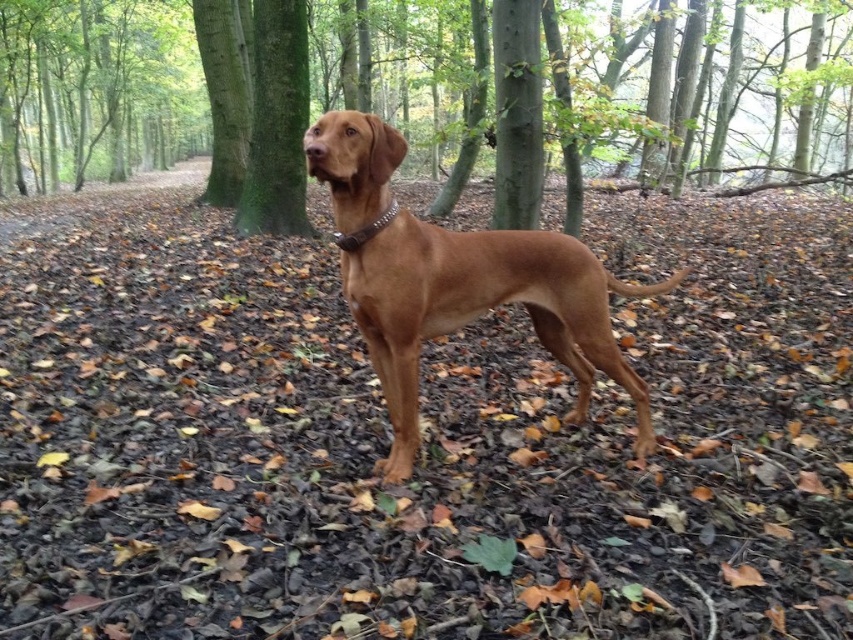
You are a hiker who wants to take a photo of the brown leather dog at center and the brown bark tree at center. Since the dog is behind the tree, can you move the tree to get a clear shot of the dog?

The brown leather dog at center is behind the brown bark tree at center, so you cannot move the tree. To get a clear shot of the dog, you might need to position yourself around the tree or wait for the dog to move closer to the front.

You are a photographer trying to capture the brown bark tree at center and the brown leather dog at center in a single shot. Based on their positions, which object would appear closer to the camera in the photo?

The brown leather dog at center appears closer to the camera because the brown bark tree at center is positioned above it, indicating the dog is lower in the frame.